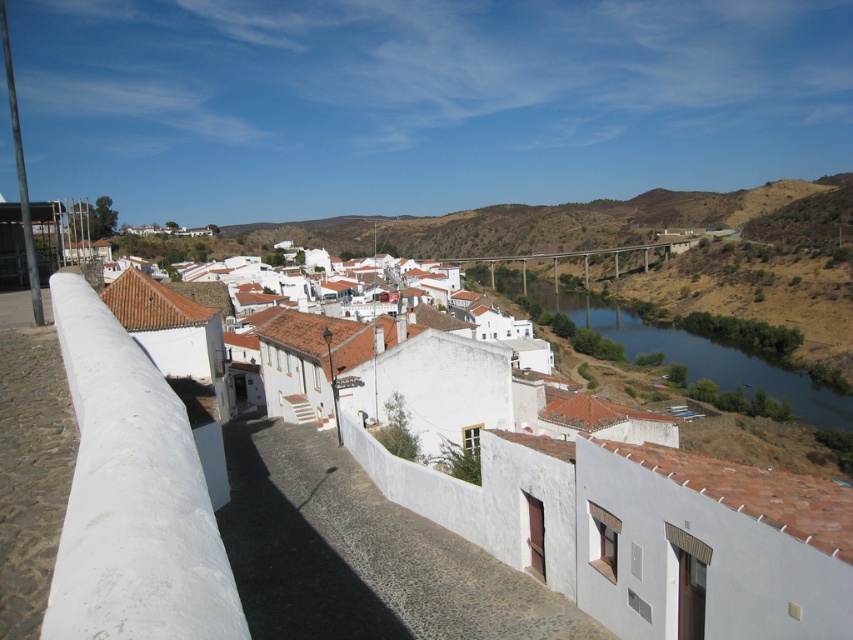
Is blue smooth water at center bigger than matte concrete bridge at center?

Incorrect, blue smooth water at center is not larger than matte concrete bridge at center.

Is blue smooth water at center taller than matte concrete bridge at center?

Yes, blue smooth water at center is taller than matte concrete bridge at center.

At what (x,y) coordinates should I click in order to perform the action: click on blue smooth water at center. Please return your answer as a coordinate pair (x, y). Looking at the image, I should click on (701, 355).

Locate an element on the screen. The height and width of the screenshot is (640, 853). blue smooth water at center is located at coordinates (701, 355).